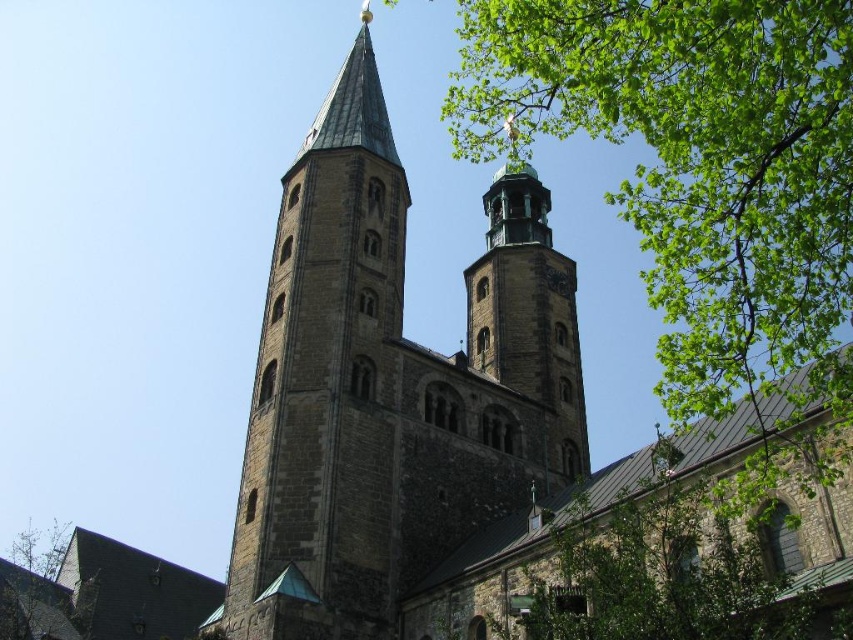
You are standing in front of the church and want to take a photo that includes both the dark gray stone tower at center and the green leafy tree at lower right. Which object should you position closer to the center of your camera frame to ensure both are fully visible?

The dark gray stone tower at center is much taller than the green leafy tree at lower right, so you should position the dark gray stone tower at center closer to the center of your camera frame to ensure both are fully visible.

You are standing in front of the historic stone church and notice a green leafy tree at upper right and a dark gray stone tower at center. Which object is closer to you from your current viewpoint?

The green leafy tree at upper right is closer to you because it is in front of the dark gray stone tower at center.